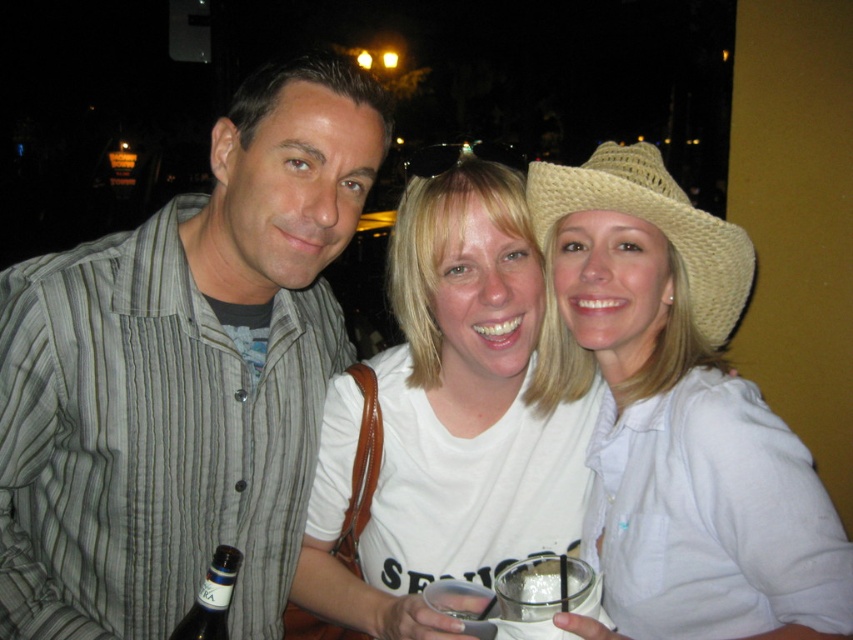
Question: Which point is closer to the camera?

Choices:
 (A) striped cotton shirt at left
 (B) white cotton shirt at center

Answer: (B)

Question: Does white cotton shirt at center appear under natural straw hat at center?

Choices:
 (A) no
 (B) yes

Answer: (B)

Question: Is striped cotton shirt at left thinner than dark brown glass bottle at center?

Choices:
 (A) yes
 (B) no

Answer: (B)

Question: Which object is the farthest from the white cotton shirt at center?

Choices:
 (A) white woven straw hat at upper right
 (B) striped cotton shirt at left
 (C) natural straw hat at center
 (D) dark brown glass bottle at center

Answer: (D)

Question: Does white cotton shirt at center have a greater width compared to dark brown glass bottle at center?

Choices:
 (A) no
 (B) yes

Answer: (B)

Question: Which is nearer to the white woven straw hat at upper right?

Choices:
 (A) white cotton shirt at center
 (B) dark brown glass bottle at center
 (C) striped cotton shirt at left

Answer: (A)